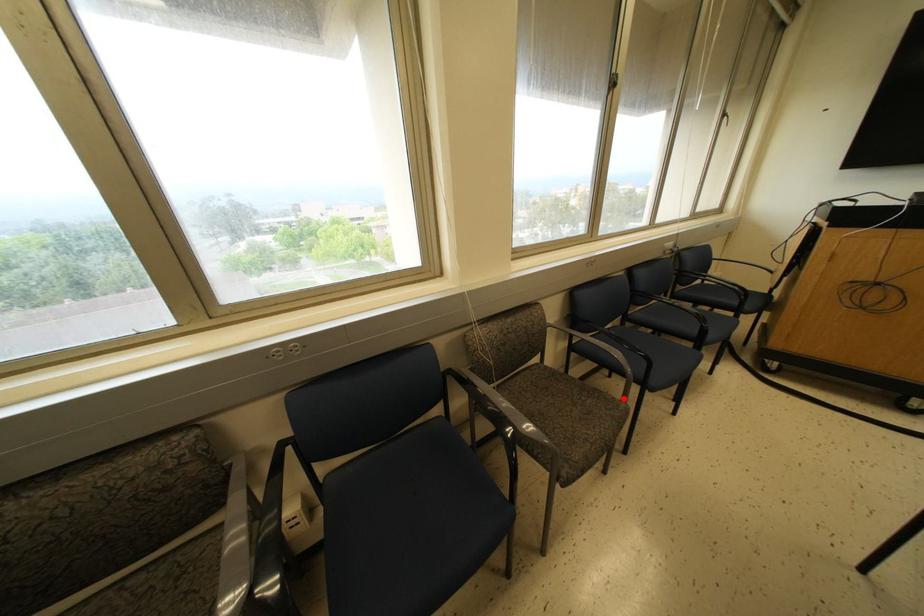
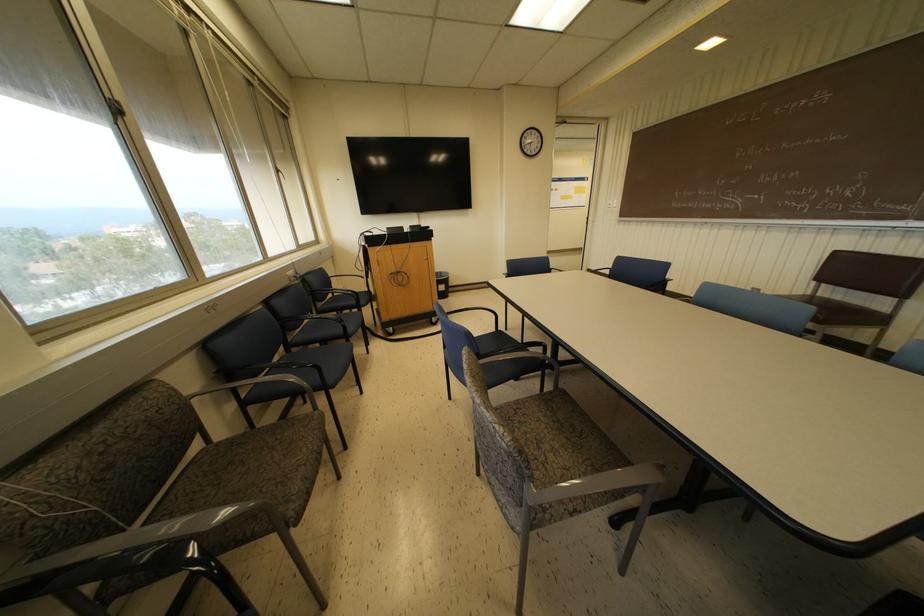
Where in the second image is the point corresponding to the highlighted location from the first image?

(314, 408)